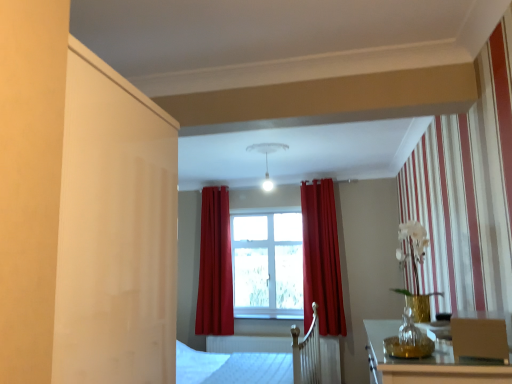
Question: Would you say white matte light fixture at upper center is to the left or to the right of matte red curtain at center, which ranks as the 1th curtain in right-to-left order, in the picture?

Choices:
 (A) right
 (B) left

Answer: (B)

Question: From a real-world perspective, is white matte light fixture at upper center physically located above or below matte red curtain at center, the second curtain from the left?

Choices:
 (A) above
 (B) below

Answer: (A)

Question: Which object is the closest to the white wood bed frame at center?

Choices:
 (A) white matte light fixture at upper center
 (B) matte red curtain at center, the second curtain from the left
 (C) matte brown armchair at lower right
 (D) matte red curtain at center, arranged as the second curtain when viewed from the right
 (E) clear glass window at center

Answer: (B)

Question: Which object is the closest to the matte brown armchair at lower right?

Choices:
 (A) transparent glass vase at lower right
 (B) matte red curtain at center, arranged as the second curtain when viewed from the right
 (C) white wood bed frame at center
 (D) matte red curtain at center, the second curtain from the left
 (E) white matte light fixture at upper center

Answer: (A)